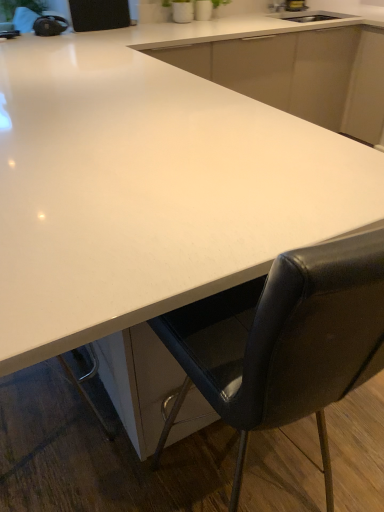
Question: Does white glossy countertop at center have a larger size compared to white glossy countertop at center?

Choices:
 (A) yes
 (B) no

Answer: (B)

Question: Is white glossy countertop at center completely or partially outside of white glossy countertop at center?

Choices:
 (A) no
 (B) yes

Answer: (A)

Question: From the image's perspective, is white glossy countertop at center on white glossy countertop at center?

Choices:
 (A) no
 (B) yes

Answer: (B)

Question: Does white glossy countertop at center have a greater height compared to white glossy countertop at center?

Choices:
 (A) yes
 (B) no

Answer: (B)

Question: Is white glossy countertop at center turned away from white glossy countertop at center?

Choices:
 (A) no
 (B) yes

Answer: (B)

Question: From the image's perspective, is white glossy countertop at center below white glossy countertop at center?

Choices:
 (A) no
 (B) yes

Answer: (A)

Question: Can we say white glossy countertop at center lies outside black leather chair at lower right?

Choices:
 (A) yes
 (B) no

Answer: (A)

Question: Is black leather chair at lower right inside white glossy countertop at center?

Choices:
 (A) yes
 (B) no

Answer: (A)

Question: Does white glossy countertop at center appear on the right side of black leather chair at lower right?

Choices:
 (A) no
 (B) yes

Answer: (B)

Question: Is white glossy countertop at center positioned far away from black leather chair at lower right?

Choices:
 (A) no
 (B) yes

Answer: (A)

Question: Considering the relative sizes of white glossy countertop at center and black leather chair at lower right in the image provided, is white glossy countertop at center taller than black leather chair at lower right?

Choices:
 (A) yes
 (B) no

Answer: (B)

Question: Does white glossy countertop at center have a greater width compared to black leather chair at lower right?

Choices:
 (A) no
 (B) yes

Answer: (B)

Question: Would you say black leather chair at lower right is outside white glossy countertop at center?

Choices:
 (A) no
 (B) yes

Answer: (B)